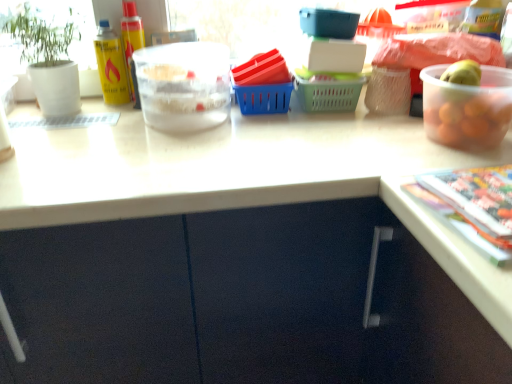
The width and height of the screenshot is (512, 384). In order to click on free space in front of green matte plant pot at left in this screenshot , I will do `click(56, 134)`.